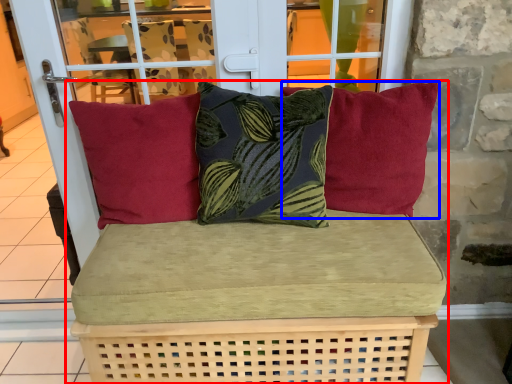
Question: Which of the following is the farthest to the observer, studio couch (highlighted by a red box) or pillow (highlighted by a blue box)?

Choices:
 (A) studio couch
 (B) pillow

Answer: (B)